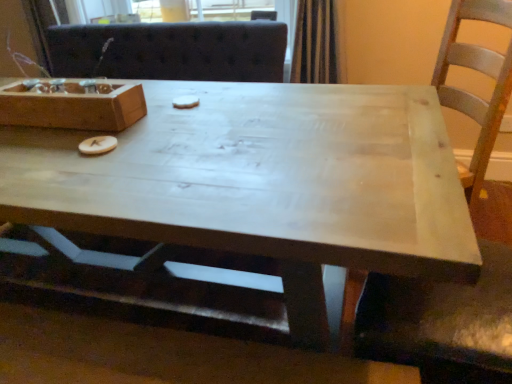
Image resolution: width=512 pixels, height=384 pixels. Identify the location of light wood coffee table at center. (259, 184).

Identify the location of wooden box at upper left. (73, 107).

You are a GUI agent. You are given a task and a screenshot of the screen. Output one action in this format:
    pyautogui.click(x=<x>, y=<y>)
    Task: Click on the wooden letter at center, arranged as the first food when ordered from the bottom
    This screenshot has height=384, width=512.
    Given the screenshot: What is the action you would take?
    pyautogui.click(x=97, y=145)

The image size is (512, 384). Describe the element at coordinates (97, 145) in the screenshot. I see `wooden letter at center, which is counted as the 2th food, starting from the top` at that location.

This screenshot has height=384, width=512. Identify the location of white matte cookie at center, the first food when ordered from right to left. (185, 102).

Considering the sizes of objects white matte cookie at center, which appears as the 2th food when viewed from the front, and wooden box at upper left in the image provided, who is wider, white matte cookie at center, which appears as the 2th food when viewed from the front, or wooden box at upper left?

wooden box at upper left is wider.

From the image's perspective, which is below, white matte cookie at center, the first food when ordered from right to left, or wooden box at upper left?

wooden box at upper left is shown below in the image.

Find the location of a particular element. This screenshot has width=512, height=384. food behind the wooden box at upper left is located at coordinates (185, 102).

Does white matte cookie at center, which is the 2th food in left-to-right order, come behind wooden box at upper left?

Yes, white matte cookie at center, which is the 2th food in left-to-right order, is behind wooden box at upper left.

From a real-world perspective, which object rests below the other?

light wood coffee table at center is physically lower.

From the image's perspective, which object appears higher, light wood coffee table at center or wooden letter at center, the 2th food positioned from the back?

From the image's view, wooden letter at center, the 2th food positioned from the back, is above.

Considering the positions of point (333, 99) and point (83, 142), is point (333, 99) closer or farther from the camera than point (83, 142)?

Point (333, 99) appears to be farther away from the viewer than point (83, 142).

I want to click on food that is the 1st object located behind the light wood coffee table at center, so click(x=97, y=145).

Which of these two, wooden box at upper left or white matte cookie at center, which is the 2th food from bottom to top, is smaller?

white matte cookie at center, which is the 2th food from bottom to top, is smaller.

Which of these two, wooden box at upper left or white matte cookie at center, positioned as the first food in top-to-bottom order, is thinner?

white matte cookie at center, positioned as the first food in top-to-bottom order, is thinner.

Which is correct: wooden box at upper left is inside white matte cookie at center, the first food when ordered from right to left, or outside of it?

wooden box at upper left lies outside white matte cookie at center, the first food when ordered from right to left.

Where is `box in front of the white matte cookie at center, positioned as the first food in top-to-bottom order`? box in front of the white matte cookie at center, positioned as the first food in top-to-bottom order is located at coordinates (73, 107).

From a real-world perspective, who is located lower, wooden letter at center, which appears as the second food when viewed from the right, or light wood coffee table at center?

light wood coffee table at center is physically lower.

Which point is more forward, (86, 147) or (77, 174)?

The point (77, 174) is in front.

Could light wood coffee table at center be considered to be inside wooden letter at center, which is counted as the 2th food, starting from the top?

No, light wood coffee table at center is not inside wooden letter at center, which is counted as the 2th food, starting from the top.

From their relative heights in the image, would you say wooden letter at center, arranged as the first food when ordered from the bottom, is taller or shorter than light wood coffee table at center?

In the image, wooden letter at center, arranged as the first food when ordered from the bottom, appears to be shorter than light wood coffee table at center.

Consider the image. Does wooden box at upper left have a greater width compared to light wood coffee table at center?

No.

The height and width of the screenshot is (384, 512). In order to click on box on the left side of light wood coffee table at center in this screenshot , I will do `click(73, 107)`.

Considering the positions of objects wooden box at upper left and light wood coffee table at center in the image provided, who is more to the left, wooden box at upper left or light wood coffee table at center?

wooden box at upper left is more to the left.

Would you say wooden box at upper left is a long distance from light wood coffee table at center?

No.

Consider the image. Is light wood coffee table at center to the left or to the right of white matte cookie at center, which is the 2th food in left-to-right order, in the image?

Clearly, light wood coffee table at center is on the left of white matte cookie at center, which is the 2th food in left-to-right order, in the image.

Does point (327, 325) come behind point (192, 106)?

No, it is not.

From the picture: Is there a large distance between light wood coffee table at center and white matte cookie at center, the first food when ordered from right to left?

No.

Is light wood coffee table at center positioned behind white matte cookie at center, which appears as the 2th food when viewed from the front?

No, it is not.

Does white matte cookie at center, which appears as the 2th food when viewed from the front, contain light wood coffee table at center?

Definitely not — light wood coffee table at center is not inside white matte cookie at center, which appears as the 2th food when viewed from the front.

At what (x,y) coordinates should I click in order to perform the action: click on coffee table on the left of white matte cookie at center, which is the 2th food from bottom to top. Please return your answer as a coordinate pair (x, y). Looking at the image, I should click on (259, 184).

From a real-world perspective, does white matte cookie at center, which is the 2th food from bottom to top, sit lower than light wood coffee table at center?

No, from a real-world perspective, white matte cookie at center, which is the 2th food from bottom to top, is not below light wood coffee table at center.

Is white matte cookie at center, which is the 2th food from bottom to top, looking in the opposite direction of light wood coffee table at center?

Yes, white matte cookie at center, which is the 2th food from bottom to top, is facing away from light wood coffee table at center.

What are the coordinates of `box positioned vertically above the white matte cookie at center, which is the 2th food from bottom to top (from a real-world perspective)` in the screenshot? It's located at (73, 107).

From the image's perspective, which food is the 1st one above the light wood coffee table at center? Please provide its 2D coordinates.

[(97, 145)]

Looking at the image, which one is located further to light wood coffee table at center, wooden letter at center, which appears as the second food when viewed from the right, or white matte cookie at center, the first food when ordered from right to left?

white matte cookie at center, the first food when ordered from right to left.

From the image, which object appears to be nearer to wooden box at upper left, white matte cookie at center, which is the first food from back to front, or light wood coffee table at center?

Among the two, white matte cookie at center, which is the first food from back to front, is located nearer to wooden box at upper left.

Estimate the real-world distances between objects in this image. Which object is closer to light wood coffee table at center, wooden box at upper left or wooden letter at center, which appears as the first food when viewed from the left?

wooden box at upper left lies closer to light wood coffee table at center than the other object.

When comparing their distances from white matte cookie at center, which appears as the 2th food when viewed from the front, does wooden box at upper left or light wood coffee table at center seem closer?

wooden box at upper left is positioned closer to the anchor white matte cookie at center, which appears as the 2th food when viewed from the front.

From the image, which object appears to be nearer to wooden letter at center, arranged as the first food when ordered from the bottom, wooden box at upper left or light wood coffee table at center?

The object closer to wooden letter at center, arranged as the first food when ordered from the bottom, is wooden box at upper left.

When comparing their distances from wooden box at upper left, does wooden letter at center, which appears as the second food when viewed from the right, or light wood coffee table at center seem further?

light wood coffee table at center lies further to wooden box at upper left than the other object.

From the image, which object appears to be farther from white matte cookie at center, the first food when ordered from right to left, wooden letter at center, which is counted as the 2th food, starting from the top, or wooden box at upper left?

The object further to white matte cookie at center, the first food when ordered from right to left, is wooden letter at center, which is counted as the 2th food, starting from the top.

Considering their positions, is light wood coffee table at center positioned closer to wooden letter at center, the 2th food positioned from the back, than white matte cookie at center, which is the first food from back to front?

Based on the image, white matte cookie at center, which is the first food from back to front, appears to be nearer to wooden letter at center, the 2th food positioned from the back.

Where is `food between light wood coffee table at center and white matte cookie at center, which appears as the 2th food when viewed from the front, along the z-axis`? food between light wood coffee table at center and white matte cookie at center, which appears as the 2th food when viewed from the front, along the z-axis is located at coordinates (97, 145).

The image size is (512, 384). I want to click on food located between wooden box at upper left and white matte cookie at center, the first food when ordered from right to left, in the left-right direction, so click(97, 145).

Where is `food located between light wood coffee table at center and wooden box at upper left in the depth direction`? The image size is (512, 384). food located between light wood coffee table at center and wooden box at upper left in the depth direction is located at coordinates (97, 145).

The width and height of the screenshot is (512, 384). I want to click on box between light wood coffee table at center and white matte cookie at center, which appears as the 2th food when viewed from the front, along the z-axis, so click(73, 107).